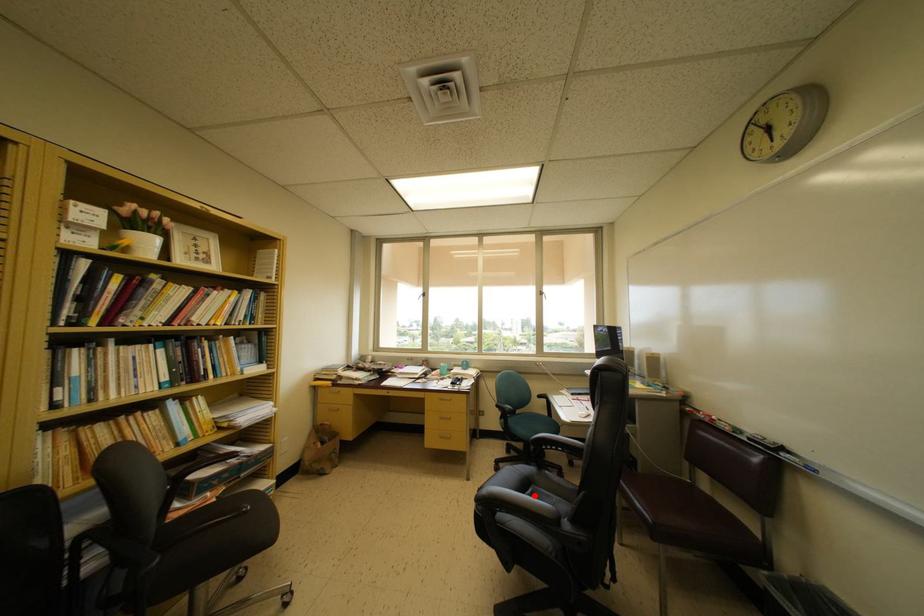
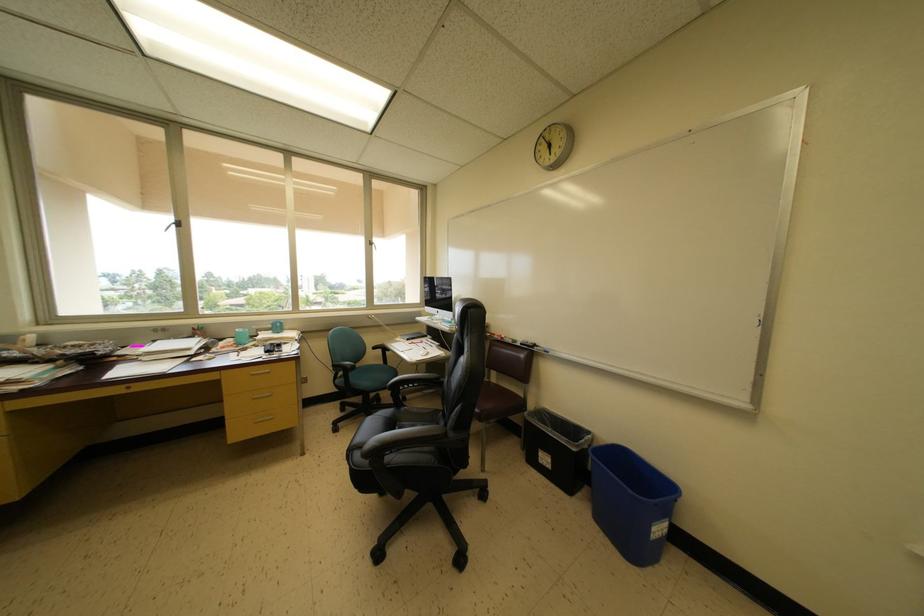
Find the pixel in the second image that matches the highlighted location in the first image.

(400, 432)